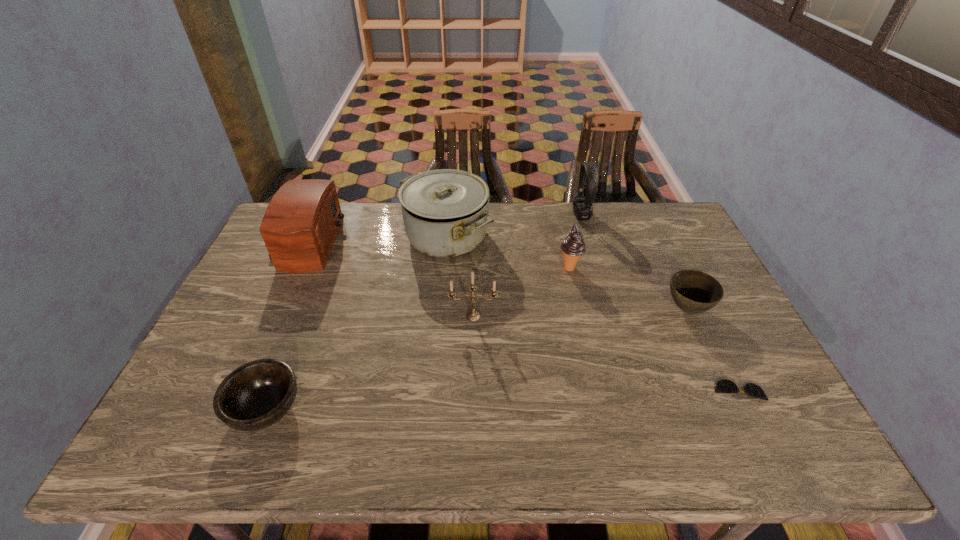
Locate an element on the screen. Image resolution: width=960 pixels, height=540 pixels. saucepan located at the far edge is located at coordinates (446, 212).

Locate an element on the screen. This screenshot has width=960, height=540. radio receiver situated at the far edge is located at coordinates (300, 225).

Where is `object located at the near edge`? This screenshot has height=540, width=960. object located at the near edge is located at coordinates (256, 395).

Identify the location of radio receiver that is at the left edge. (300, 225).

Where is `bowl that is at the left edge`? The width and height of the screenshot is (960, 540). bowl that is at the left edge is located at coordinates (256, 395).

The height and width of the screenshot is (540, 960). What are the coordinates of `bowl that is at the right edge` in the screenshot? It's located at (693, 291).

Locate an element on the screen. spectacles present at the right edge is located at coordinates (723, 386).

Identify the location of object located in the far left corner section of the desktop. This screenshot has width=960, height=540. (300, 225).

Identify the location of object located at the near left corner. (256, 395).

In the image, there is a desktop. Where is `free space at the far edge`? free space at the far edge is located at coordinates (352, 235).